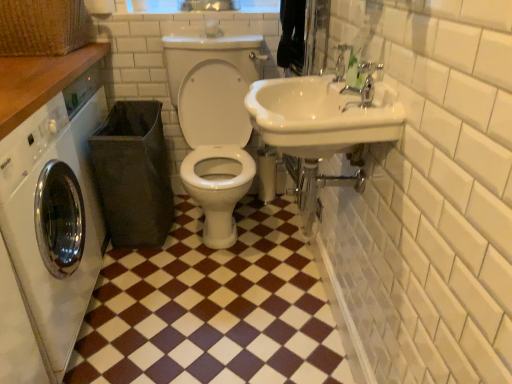
Question: Is wooden counter at upper left beside silver metallic faucet at upper right?

Choices:
 (A) yes
 (B) no

Answer: (B)

Question: Could silver metallic faucet at upper right be considered to be inside wooden counter at upper left?

Choices:
 (A) yes
 (B) no

Answer: (B)

Question: Is wooden counter at upper left turned away from silver metallic faucet at upper right?

Choices:
 (A) no
 (B) yes

Answer: (A)

Question: From the image's perspective, does wooden counter at upper left appear higher than silver metallic faucet at upper right?

Choices:
 (A) no
 (B) yes

Answer: (B)

Question: Is wooden counter at upper left not inside silver metallic faucet at upper right?

Choices:
 (A) no
 (B) yes

Answer: (B)

Question: Is white glossy washing machine at left taller or shorter than white matte toilet paper at upper center?

Choices:
 (A) tall
 (B) short

Answer: (A)

Question: Considering the positions of white glossy washing machine at left and white matte toilet paper at upper center in the image, is white glossy washing machine at left bigger or smaller than white matte toilet paper at upper center?

Choices:
 (A) small
 (B) big

Answer: (B)

Question: From a real-world perspective, is white glossy washing machine at left positioned above or below white matte toilet paper at upper center?

Choices:
 (A) below
 (B) above

Answer: (A)

Question: Is point (83, 107) closer or farther from the camera than point (92, 11)?

Choices:
 (A) closer
 (B) farther

Answer: (A)

Question: From the image's perspective, is wooden counter at upper left above or below white matte toilet paper at upper center?

Choices:
 (A) above
 (B) below

Answer: (B)

Question: Is wooden counter at upper left inside or outside of white matte toilet paper at upper center?

Choices:
 (A) outside
 (B) inside

Answer: (A)

Question: Is wooden counter at upper left taller or shorter than white matte toilet paper at upper center?

Choices:
 (A) tall
 (B) short

Answer: (B)

Question: Is wooden counter at upper left in front of or behind white matte toilet paper at upper center in the image?

Choices:
 (A) behind
 (B) front

Answer: (B)

Question: From a real-world perspective, is brown glossy tile at lower left above or below white glossy washing machine at left?

Choices:
 (A) above
 (B) below

Answer: (B)

Question: Is brown glossy tile at lower left in front of or behind white glossy washing machine at left in the image?

Choices:
 (A) front
 (B) behind

Answer: (B)